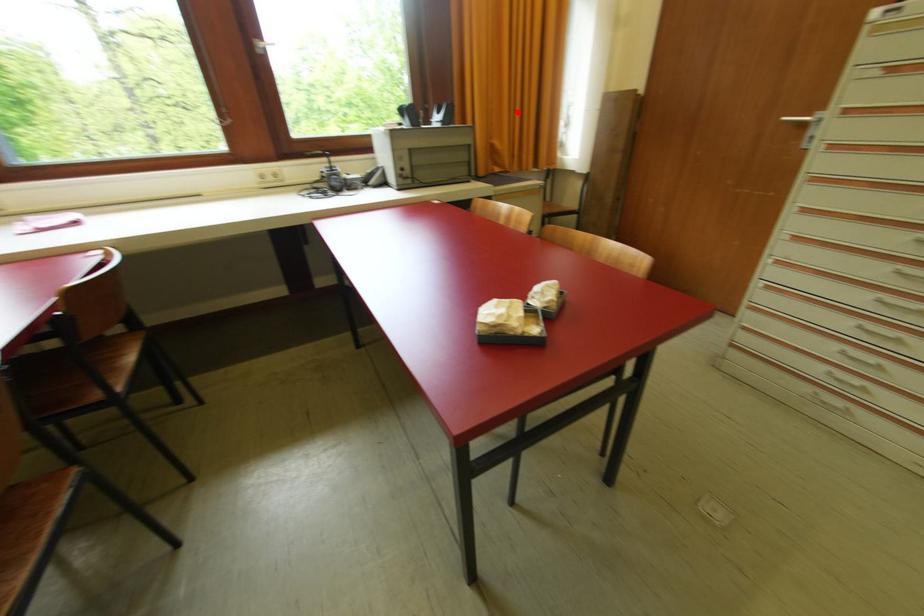
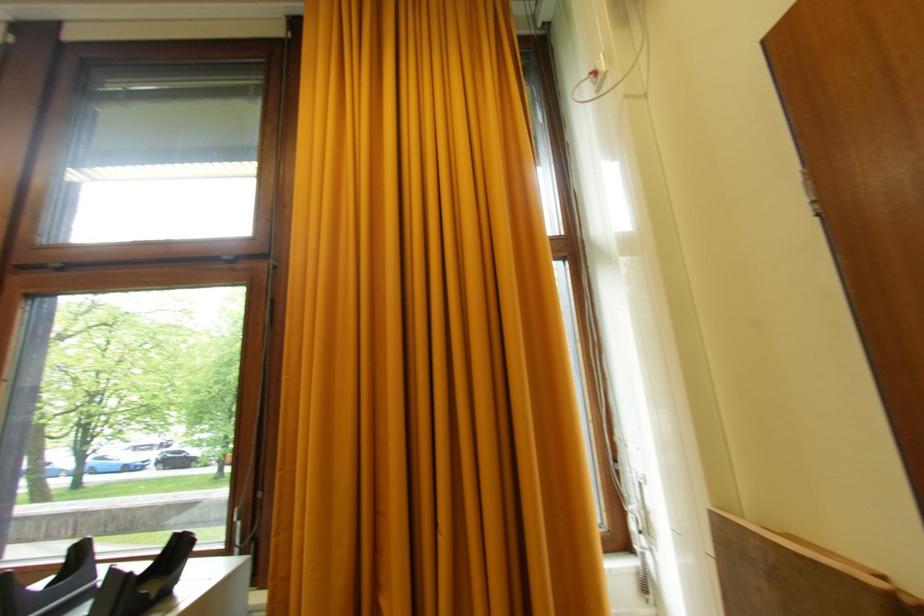
Where in the second image is the point corresponding to the highlighted location from the first image?

(438, 525)